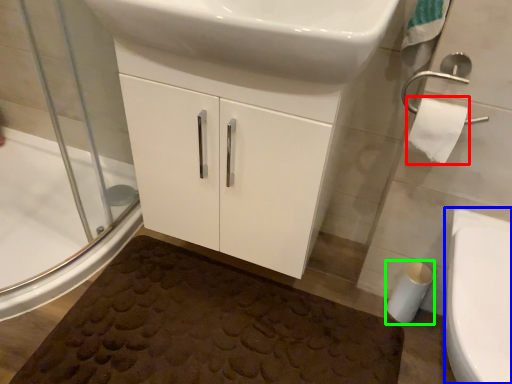
Question: Estimate the real-world distances between objects in this image. Which object is farther from toilet paper (highlighted by a red box), bidet (highlighted by a blue box) or toilet paper (highlighted by a green box)?

Choices:
 (A) bidet
 (B) toilet paper

Answer: (B)